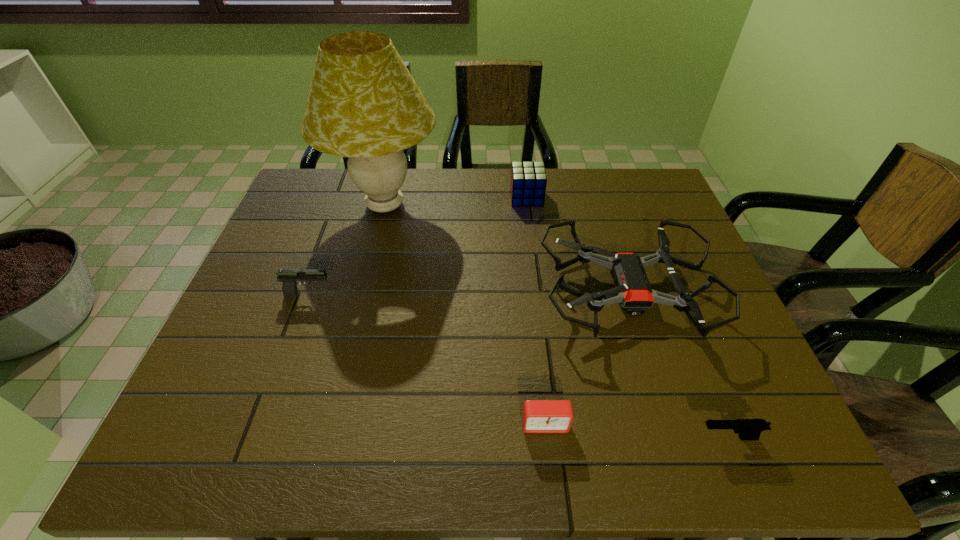
The width and height of the screenshot is (960, 540). Find the location of `empty space between the alarm clock and the drone`. empty space between the alarm clock and the drone is located at coordinates (586, 358).

Locate an element on the screen. vacant area that lies between the tallest object and the farther pistol is located at coordinates (347, 249).

At what (x,y) coordinates should I click in order to perform the action: click on free spot between the right pistol and the left pistol. Please return your answer as a coordinate pair (x, y). Looking at the image, I should click on (518, 366).

Identify the location of object that can be found as the third closest to the alarm clock. (289, 278).

Select which object appears as the second closest to the alarm clock. Please provide its 2D coordinates. Your answer should be formatted as a tuple, i.e. [(x, y)], where the tuple contains the x and y coordinates of a point satisfying the conditions above.

[(747, 429)]

Where is `vacant area that satisfies the following two spatial constraints: 1. with the camera facing forward on the drone; 2. on the front-facing side of the alarm clock`? The height and width of the screenshot is (540, 960). vacant area that satisfies the following two spatial constraints: 1. with the camera facing forward on the drone; 2. on the front-facing side of the alarm clock is located at coordinates (666, 424).